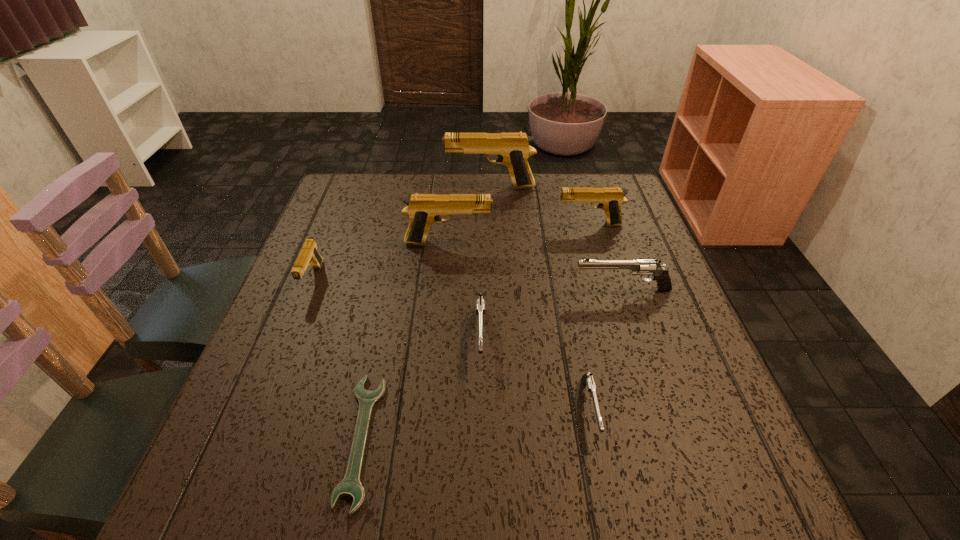
Identify which pistol is the closest to the third nearest tan pistol. Please provide its 2D coordinates. Your answer should be formatted as a tuple, i.e. [(x, y)], where the tuple contains the x and y coordinates of a point satisfying the conditions above.

[(513, 150)]

Select which pistol is the sixth closest to the second smallest silver pistol. Please provide its 2D coordinates. Your answer should be formatted as a tuple, i.e. [(x, y)], where the tuple contains the x and y coordinates of a point satisfying the conditions above.

[(513, 150)]

Locate an element on the screen. This screenshot has height=540, width=960. tan pistol that is the closest one to the farthest object is located at coordinates (610, 199).

Select which tan pistol appears as the closest to the farthest tan pistol. Please provide its 2D coordinates. Your answer should be formatted as a tuple, i.e. [(x, y)], where the tuple contains the x and y coordinates of a point satisfying the conditions above.

[(610, 199)]

At what (x,y) coordinates should I click in order to perform the action: click on silver pistol that stands as the closest to the tallest pistol. Please return your answer as a coordinate pair (x, y). This screenshot has width=960, height=540. Looking at the image, I should click on (641, 267).

Identify the location of silver pistol that is the second closest to the leftmost object. (641, 267).

Find the location of a particular element. The height and width of the screenshot is (540, 960). free space that satisfies the following two spatial constraints: 1. on the front-facing side of the farthest silver pistol; 2. on the front-facing side of the smallest silver pistol is located at coordinates (662, 409).

You are a GUI agent. You are given a task and a screenshot of the screen. Output one action in this format:
    pyautogui.click(x=<x>, y=<y>)
    Task: Click on the blank space that satisfies the following two spatial constraints: 1. at the barrel of the seventh nearest object; 2. at the barrel of the smallest tan pistol
    Image resolution: width=960 pixels, height=540 pixels.
    Given the screenshot: What is the action you would take?
    pyautogui.click(x=606, y=279)

The height and width of the screenshot is (540, 960). I want to click on free space that satisfies the following two spatial constraints: 1. at the barrel of the rightmost tan pistol; 2. at the barrel of the nearest tan pistol, so click(x=606, y=279).